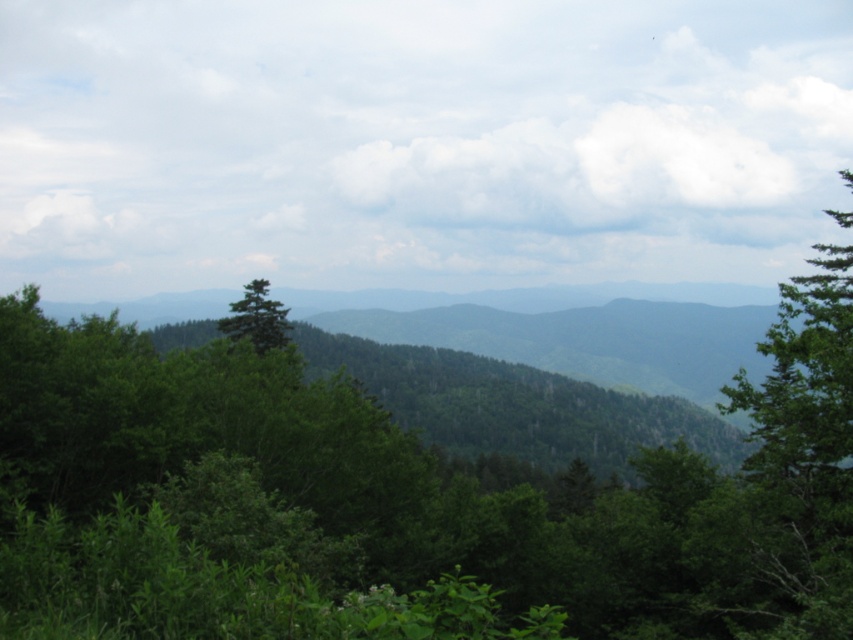
You are standing in the middle of the scene and want to walk towards the green leafy tree at right. Which direction should you move relative to the green matte tree at center?

To reach the green leafy tree at right from the middle of the scene, you should move towards the right side of the green matte tree at center since the green leafy tree at right is positioned to the right of it.

Consider the image. You are standing at the center of the image. Which direction should you walk to reach the green leafy tree at right?

You should walk to the right to reach the green leafy tree at right because it is located at the right side of the image.